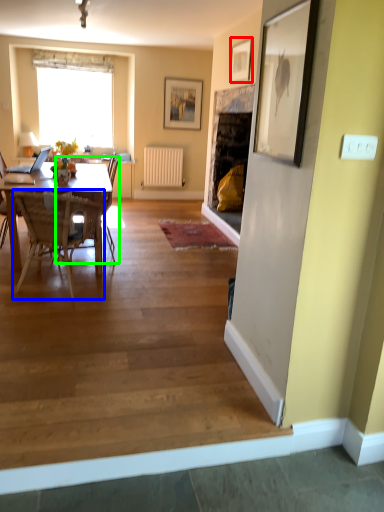
Question: Estimate the real-world distances between objects in this image. Which object is farther from picture frame (highlighted by a red box), chair (highlighted by a blue box) or chair (highlighted by a green box)?

Choices:
 (A) chair
 (B) chair

Answer: (A)